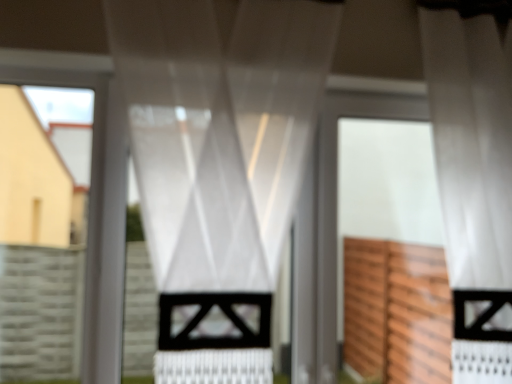
Question: Based on their positions, is white sheer curtain at center, the 2th curtain from the left, located to the left or right of white matte screen door at center?

Choices:
 (A) left
 (B) right

Answer: (B)

Question: From the image's perspective, relative to white matte screen door at center, is white sheer curtain at center, the 2th curtain from the left, above or below?

Choices:
 (A) above
 (B) below

Answer: (A)

Question: Estimate the real-world distances between objects in this image. Which object is farther from the white matte screen door at center?

Choices:
 (A) white sheer curtain at center, acting as the 1th curtain starting from the right
 (B) satin white curtain at center, which is counted as the second curtain, starting from the right

Answer: (B)

Question: Based on their relative distances, which object is nearer to the white matte screen door at center?

Choices:
 (A) satin white curtain at center, which is counted as the second curtain, starting from the right
 (B) white sheer curtain at center, acting as the 1th curtain starting from the right

Answer: (B)